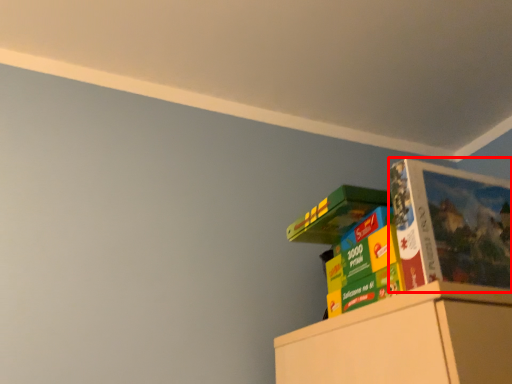
Question: From the image, what is the correct spatial relationship of paperback book (annotated by the red box) in relation to book?

Choices:
 (A) left
 (B) right

Answer: (B)